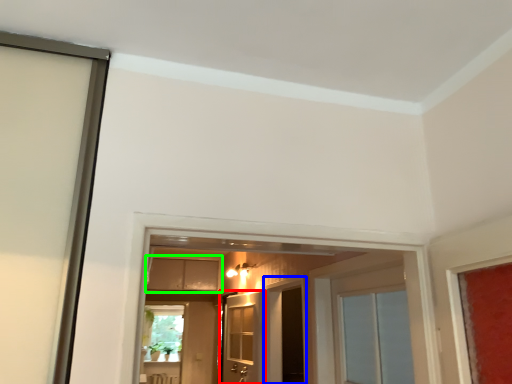
Question: Based on their relative distances, which object is nearer to door (highlighted by a red box)? Choose from screen door (highlighted by a blue box) and cabinetry (highlighted by a green box).

Choices:
 (A) screen door
 (B) cabinetry

Answer: (A)